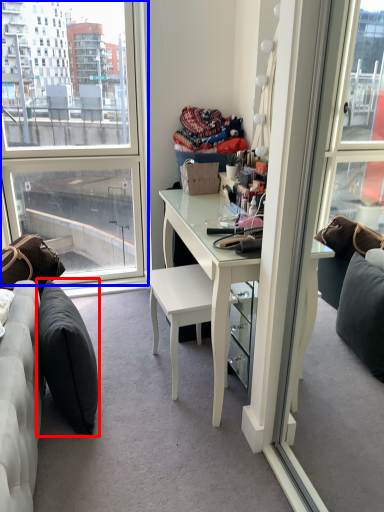
Question: Among these objects, which one is farthest to the camera, pillow (highlighted by a red box) or window (highlighted by a blue box)?

Choices:
 (A) pillow
 (B) window

Answer: (B)